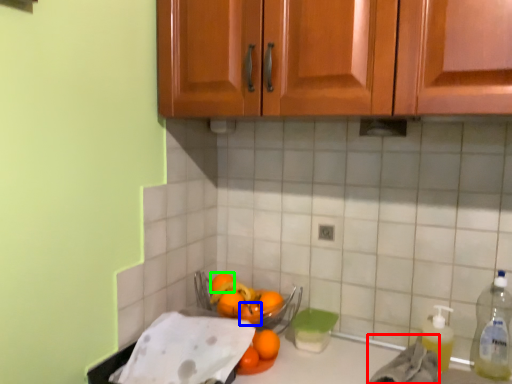
Question: Which is nearer to the material (highlighted by a red box)? orange (highlighted by a blue box) or orange (highlighted by a green box).

Choices:
 (A) orange
 (B) orange

Answer: (A)